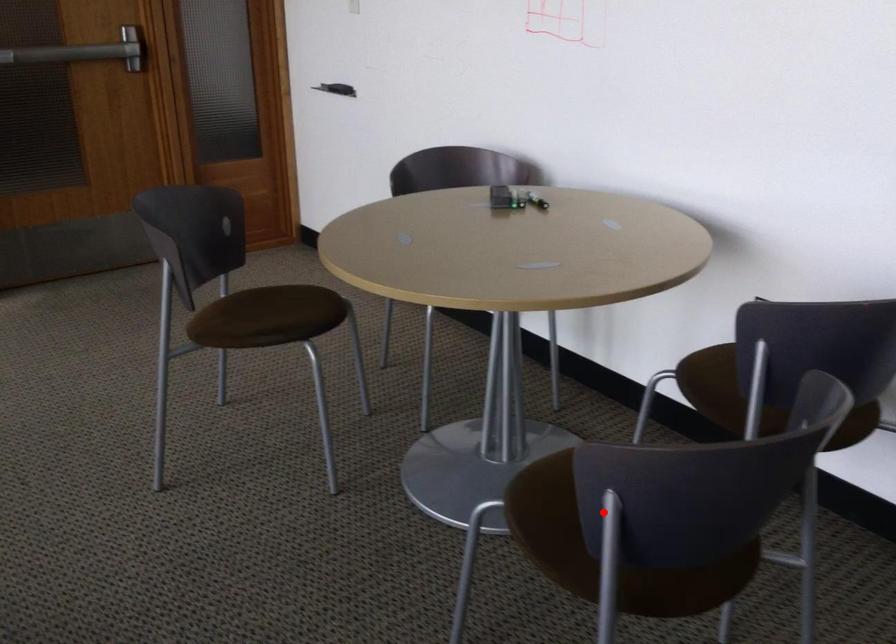
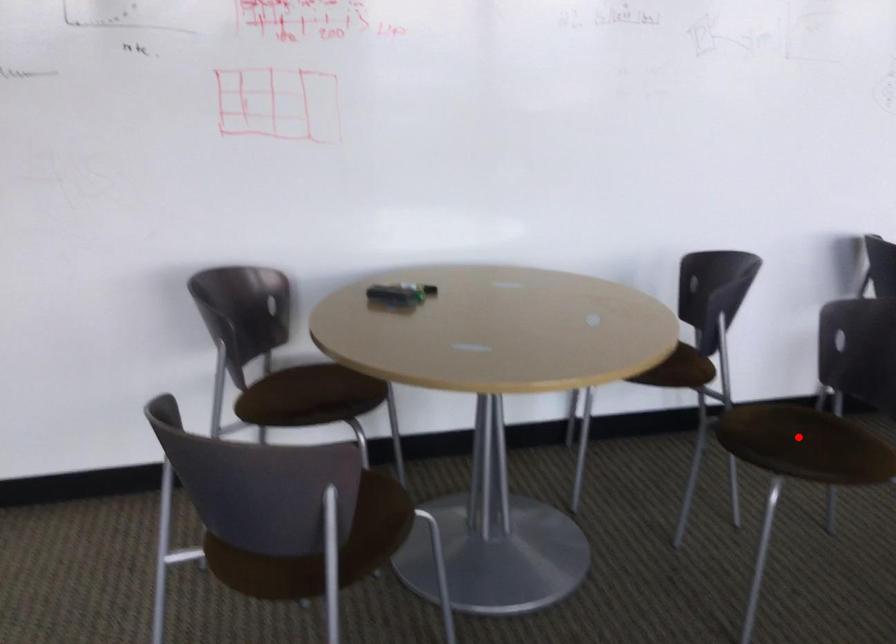
I am providing you with two images of the same scene from different viewpoints. A red point is marked on the first image and another point is marked on the second image. Are the points marked in image1 and image2 representing the same 3D position?

Yes